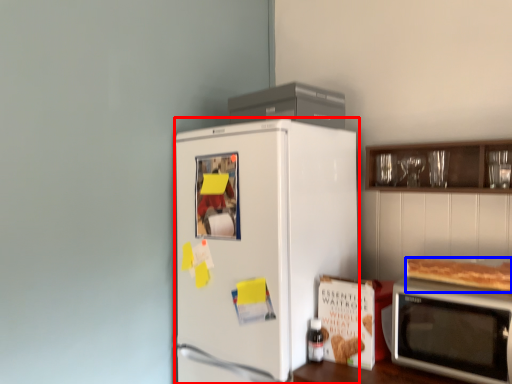
Question: Among these objects, which one is farthest to the camera, refrigerator (highlighted by a red box) or food (highlighted by a blue box)?

Choices:
 (A) refrigerator
 (B) food

Answer: (A)